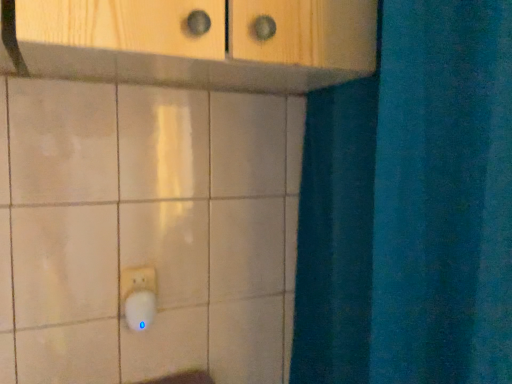
Question: From the image's perspective, is white plastic light switch at lower left on white plastic knob at lower left?

Choices:
 (A) yes
 (B) no

Answer: (A)

Question: Is the depth of white plastic light switch at lower left greater than that of white plastic knob at lower left?

Choices:
 (A) yes
 (B) no

Answer: (A)

Question: Does white plastic light switch at lower left appear on the left side of white plastic knob at lower left?

Choices:
 (A) yes
 (B) no

Answer: (A)

Question: Is white plastic light switch at lower left turned away from white plastic knob at lower left?

Choices:
 (A) yes
 (B) no

Answer: (B)

Question: Can white plastic knob at lower left be found inside white plastic light switch at lower left?

Choices:
 (A) yes
 (B) no

Answer: (B)

Question: Is white plastic light switch at lower left with white plastic knob at lower left?

Choices:
 (A) yes
 (B) no

Answer: (A)

Question: Is white plastic knob at lower left to the left of white plastic light switch at lower left from the viewer's perspective?

Choices:
 (A) no
 (B) yes

Answer: (A)

Question: From a real-world perspective, is white plastic knob at lower left positioned over white plastic light switch at lower left based on gravity?

Choices:
 (A) yes
 (B) no

Answer: (B)

Question: Would you consider white plastic knob at lower left to be distant from white plastic light switch at lower left?

Choices:
 (A) no
 (B) yes

Answer: (A)

Question: Is white plastic knob at lower left shorter than white plastic light switch at lower left?

Choices:
 (A) yes
 (B) no

Answer: (A)

Question: Could you tell me if white plastic knob at lower left is facing white plastic light switch at lower left?

Choices:
 (A) yes
 (B) no

Answer: (B)

Question: Does white plastic knob at lower left have a larger size compared to white plastic light switch at lower left?

Choices:
 (A) yes
 (B) no

Answer: (A)

Question: Choose the correct answer: Is white plastic light switch at lower left inside white plastic knob at lower left or outside it?

Choices:
 (A) inside
 (B) outside

Answer: (B)